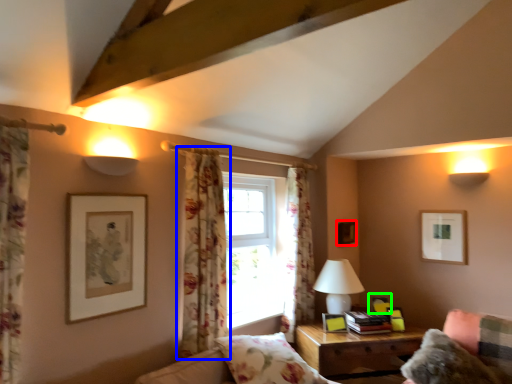
Question: Which object is the farthest from picture frame (highlighted by a red box)? Choose among these: curtain (highlighted by a blue box) or picture frame (highlighted by a green box).

Choices:
 (A) curtain
 (B) picture frame

Answer: (A)